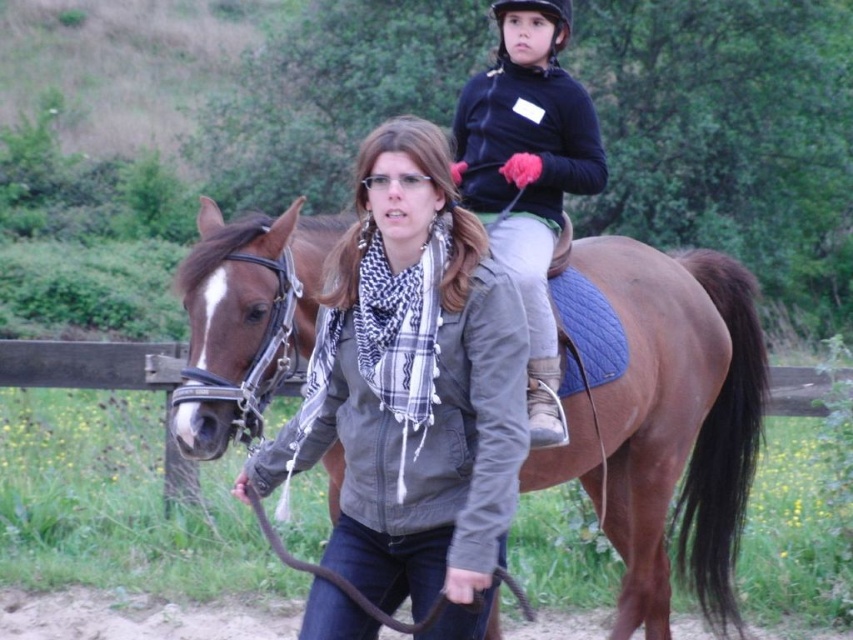
You are a delivery person who needs to place a package between the brown leather saddle at center and the black matte helmet at upper center. The package is 1.5 meters long. Can you fit it between them without bending the package?

The distance between the brown leather saddle at center and the black matte helmet at upper center is 1.61 meters. Since the package is 1.5 meters long, it can fit between them without bending.

You are a photographer standing in the middle of the scene. You want to take a photo that includes both the brown leather saddle at center and the matte gray jacket at center. Which object will appear taller in the photo?

The brown leather saddle at center will appear taller in the photo because it has a greater height compared to the matte gray jacket at center.